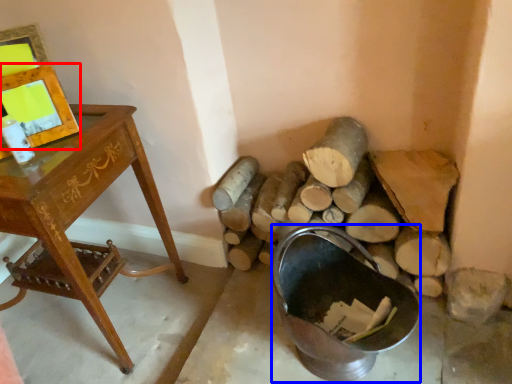
Question: Which object appears closest to the camera in this image, picture frame (highlighted by a red box) or basin (highlighted by a blue box)?

Choices:
 (A) picture frame
 (B) basin

Answer: (B)